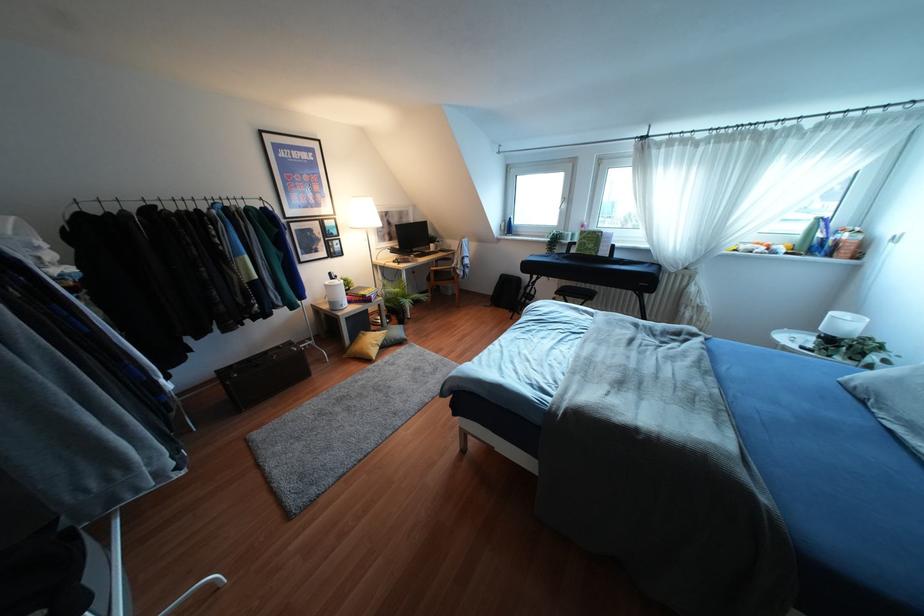
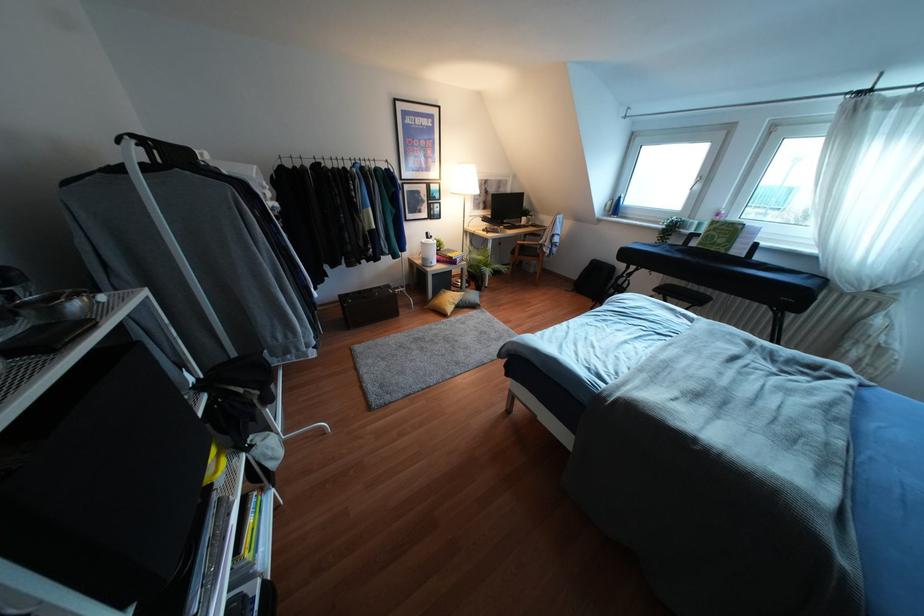
In the second image, find the point that corresponds to point (359, 334) in the first image.

(441, 292)